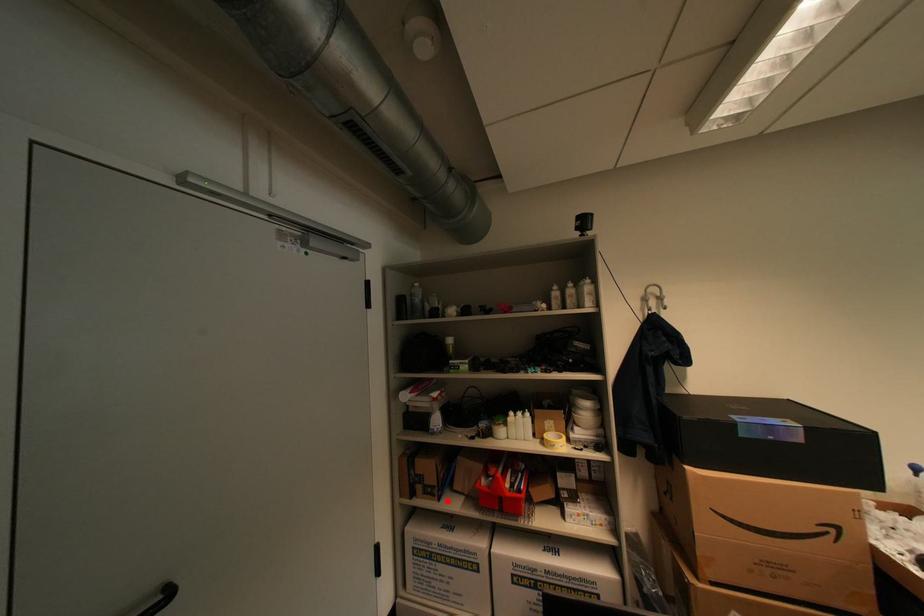
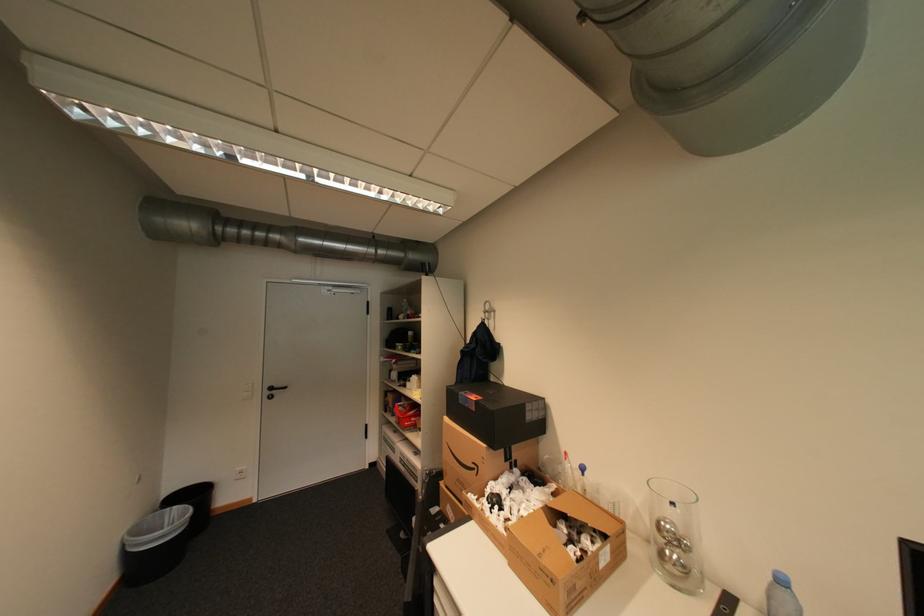
The point at the highlighted location is marked in the first image. Where is the corresponding point in the second image?

(400, 416)